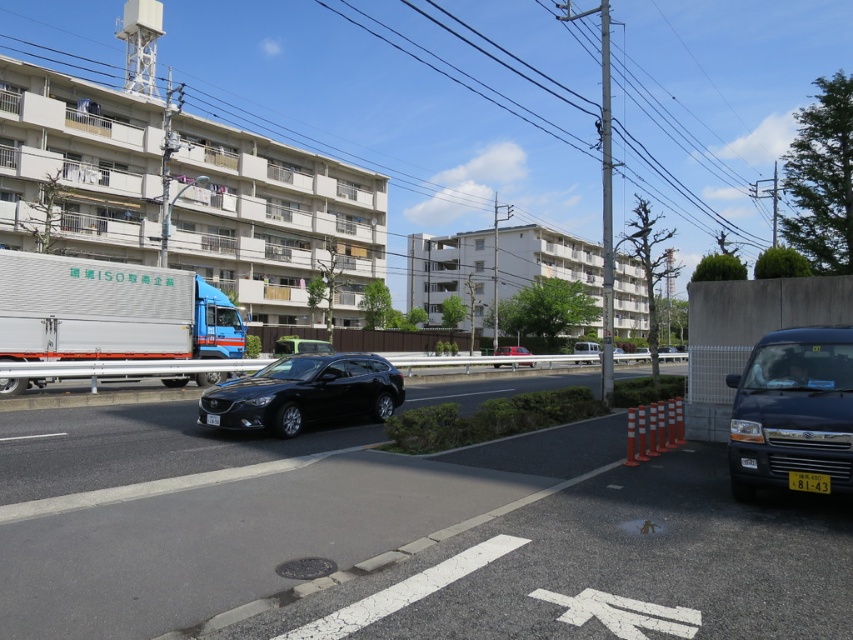
Consider the image. How distant is white matte truck at left from black matte hatchback at center?

9.28 meters

Consider the image. Who is positioned more to the right, white matte truck at left or black matte hatchback at center?

black matte hatchback at center is more to the right.

Where is `white matte truck at left`? The width and height of the screenshot is (853, 640). white matte truck at left is located at coordinates (109, 310).

Locate an element on the screen. This screenshot has width=853, height=640. white matte truck at left is located at coordinates (109, 310).

Consider the image. Is green plastic barrier at center taller than yellow plastic license plate at lower right?

Indeed, green plastic barrier at center has a greater height compared to yellow plastic license plate at lower right.

Is the position of green plastic barrier at center less distant than that of yellow plastic license plate at lower right?

No, it is behind yellow plastic license plate at lower right.

Who is more forward, (335, 330) or (816, 484)?

Point (816, 484) is more forward.

The width and height of the screenshot is (853, 640). Find the location of `green plastic barrier at center`. green plastic barrier at center is located at coordinates (395, 339).

Which of these two, metallic blue van at right or matte red car at center, stands shorter?

With less height is matte red car at center.

Does metallic blue van at right have a lesser height compared to matte red car at center?

In fact, metallic blue van at right may be taller than matte red car at center.

Is point (802, 410) positioned before point (523, 346)?

That is True.

The width and height of the screenshot is (853, 640). What are the coordinates of `metallic blue van at right` in the screenshot? It's located at (792, 410).